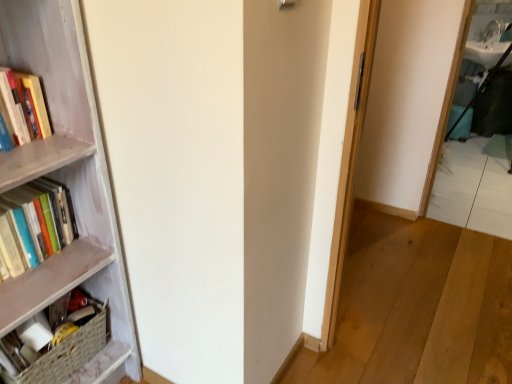
Describe the element at coordinates (70, 192) in the screenshot. I see `wooden bookcase at left` at that location.

Where is `woven basket at lower left, acting as the 2th book starting from the top`? The image size is (512, 384). woven basket at lower left, acting as the 2th book starting from the top is located at coordinates (67, 353).

The height and width of the screenshot is (384, 512). What are the coordinates of `hardcover books at left, the 2th book from the bottom` in the screenshot? It's located at click(x=35, y=224).

From a real-world perspective, who is located higher, woven basket at lower left, arranged as the first book when ordered from the bottom, or wooden bookcase at left?

wooden bookcase at left, from a real-world perspective.

Considering the relative positions of woven basket at lower left, acting as the 2th book starting from the top, and wooden bookcase at left in the image provided, is woven basket at lower left, acting as the 2th book starting from the top, behind wooden bookcase at left?

Yes.

Is woven basket at lower left, arranged as the first book when ordered from the bottom, positioned with its back to wooden bookcase at left?

That's right, woven basket at lower left, arranged as the first book when ordered from the bottom, is facing away from wooden bookcase at left.

Is point (67, 344) more distant than point (86, 197)?

Yes.

At what (x,y) coordinates should I click in order to perform the action: click on bookcase below the hardcover books at left, marked as the 1th book in a top-to-bottom arrangement (from a real-world perspective). Please return your answer as a coordinate pair (x, y). The image size is (512, 384). Looking at the image, I should click on (70, 192).

Is hardcover books at left, the 2th book from the bottom, far away from wooden bookcase at left?

hardcover books at left, the 2th book from the bottom, is near wooden bookcase at left, not far away.

From the image's perspective, does hardcover books at left, the 2th book from the bottom, appear lower than wooden bookcase at left?

No.

How different are the orientations of hardcover books at left, the 2th book from the bottom, and wooden bookcase at left in degrees?

The angle between the facing direction of hardcover books at left, the 2th book from the bottom, and the facing direction of wooden bookcase at left is 0.49 degrees.

Is wooden bookcase at left shorter than woven basket at lower left, acting as the 2th book starting from the top?

No, wooden bookcase at left is not shorter than woven basket at lower left, acting as the 2th book starting from the top.

Looking at the image, does wooden bookcase at left seem bigger or smaller compared to woven basket at lower left, arranged as the first book when ordered from the bottom?

Considering their sizes, wooden bookcase at left takes up more space than woven basket at lower left, arranged as the first book when ordered from the bottom.

How many degrees apart are the facing directions of wooden bookcase at left and hardcover books at left, marked as the 1th book in a top-to-bottom arrangement?

The angle between the facing direction of wooden bookcase at left and the facing direction of hardcover books at left, marked as the 1th book in a top-to-bottom arrangement, is 0.49 degrees.

In the image, is wooden bookcase at left positioned in front of or behind hardcover books at left, marked as the 1th book in a top-to-bottom arrangement?

Clearly, wooden bookcase at left is in front of hardcover books at left, marked as the 1th book in a top-to-bottom arrangement.

From a real-world perspective, is wooden bookcase at left physically located above or below hardcover books at left, the 2th book from the bottom?

wooden bookcase at left is below hardcover books at left, the 2th book from the bottom.

From the image's perspective, is wooden bookcase at left on hardcover books at left, the 2th book from the bottom?

No, from the image's perspective, wooden bookcase at left is not over hardcover books at left, the 2th book from the bottom.

From a real-world perspective, which is physically above, hardcover books at left, marked as the 1th book in a top-to-bottom arrangement, or woven basket at lower left, arranged as the first book when ordered from the bottom?

In real-world perspective, hardcover books at left, marked as the 1th book in a top-to-bottom arrangement, is above.

Is point (61, 226) positioned before point (88, 342)?

Yes.

Which object is closer to the camera, hardcover books at left, the 2th book from the bottom, or woven basket at lower left, acting as the 2th book starting from the top?

Positioned in front is hardcover books at left, the 2th book from the bottom.

Can you tell me how much hardcover books at left, the 2th book from the bottom, and woven basket at lower left, acting as the 2th book starting from the top, differ in facing direction?

The facing directions of hardcover books at left, the 2th book from the bottom, and woven basket at lower left, acting as the 2th book starting from the top, are 1.73 degrees apart.

Who is smaller, woven basket at lower left, arranged as the first book when ordered from the bottom, or hardcover books at left, the 2th book from the bottom?

hardcover books at left, the 2th book from the bottom.

Is woven basket at lower left, arranged as the first book when ordered from the bottom, facing away from hardcover books at left, marked as the 1th book in a top-to-bottom arrangement?

No, woven basket at lower left, arranged as the first book when ordered from the bottom,'s orientation is not away from hardcover books at left, marked as the 1th book in a top-to-bottom arrangement.

Is the position of woven basket at lower left, arranged as the first book when ordered from the bottom, less distant than that of hardcover books at left, marked as the 1th book in a top-to-bottom arrangement?

That is False.

Would you say hardcover books at left, the 2th book from the bottom, is part of woven basket at lower left, arranged as the first book when ordered from the bottom,'s contents?

A: Definitely not — hardcover books at left, the 2th book from the bottom, is not inside woven basket at lower left, arranged as the first book when ordered from the bottom.

Where is `bookcase above the woven basket at lower left, acting as the 2th book starting from the top (from the image's perspective)`? The width and height of the screenshot is (512, 384). bookcase above the woven basket at lower left, acting as the 2th book starting from the top (from the image's perspective) is located at coordinates (70, 192).

Locate an element on the screen. bookcase on the right of hardcover books at left, the 2th book from the bottom is located at coordinates [70, 192].

From the image, which object appears to be farther from wooden bookcase at left, hardcover books at left, marked as the 1th book in a top-to-bottom arrangement, or woven basket at lower left, acting as the 2th book starting from the top?

The object further to wooden bookcase at left is woven basket at lower left, acting as the 2th book starting from the top.

From the image, which object appears to be farther from wooden bookcase at left, woven basket at lower left, acting as the 2th book starting from the top, or hardcover books at left, marked as the 1th book in a top-to-bottom arrangement?

The object further to wooden bookcase at left is woven basket at lower left, acting as the 2th book starting from the top.

Which object lies nearer to the anchor point hardcover books at left, marked as the 1th book in a top-to-bottom arrangement, wooden bookcase at left or woven basket at lower left, arranged as the first book when ordered from the bottom?

The object closer to hardcover books at left, marked as the 1th book in a top-to-bottom arrangement, is wooden bookcase at left.

Based on the photo, from the image, which object appears to be farther from woven basket at lower left, arranged as the first book when ordered from the bottom, hardcover books at left, the 2th book from the bottom, or wooden bookcase at left?

The object further to woven basket at lower left, arranged as the first book when ordered from the bottom, is hardcover books at left, the 2th book from the bottom.

Based on their spatial positions, is wooden bookcase at left or hardcover books at left, marked as the 1th book in a top-to-bottom arrangement, closer to woven basket at lower left, arranged as the first book when ordered from the bottom?

wooden bookcase at left lies closer to woven basket at lower left, arranged as the first book when ordered from the bottom, than the other object.

Estimate the real-world distances between objects in this image. Which object is closer to hardcover books at left, marked as the 1th book in a top-to-bottom arrangement, woven basket at lower left, arranged as the first book when ordered from the bottom, or wooden bookcase at left?

Among the two, wooden bookcase at left is located nearer to hardcover books at left, marked as the 1th book in a top-to-bottom arrangement.

Image resolution: width=512 pixels, height=384 pixels. I want to click on book located between wooden bookcase at left and woven basket at lower left, arranged as the first book when ordered from the bottom, in the depth direction, so click(35, 224).